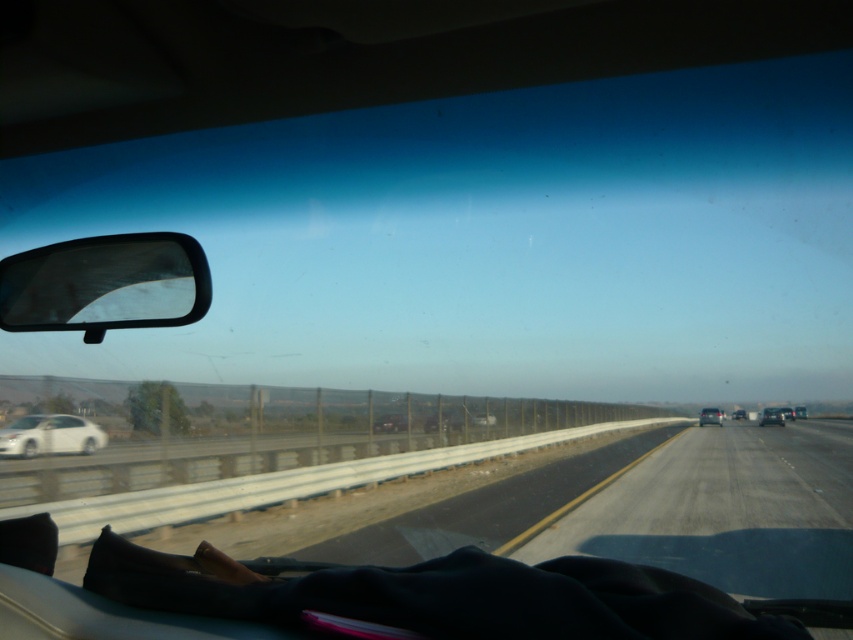
Is point (30, 435) behind point (386, 432)?

That is False.

In the scene shown: Can you confirm if white matte sedan at left is shorter than metallic silver sedan at center?

No.

Is point (42, 449) more distant than point (380, 420)?

No, it is in front of (380, 420).

Find the location of a particular element. white matte sedan at left is located at coordinates [x=50, y=435].

Looking at this image, which of these two, black glossy sedan at center-right or silver metallic sedan at center, stands taller?

black glossy sedan at center-right is taller.

Is point (764, 408) farther from viewer compared to point (711, 422)?

Yes, it is behind point (711, 422).

I want to click on black glossy sedan at center-right, so click(770, 417).

Is metallic silver sedan at center above silver metallic sedan at center?

Correct, metallic silver sedan at center is located above silver metallic sedan at center.

Describe the element at coordinates (389, 422) in the screenshot. Image resolution: width=853 pixels, height=640 pixels. I see `metallic silver sedan at center` at that location.

This screenshot has width=853, height=640. I want to click on metallic silver sedan at center, so tap(389, 422).